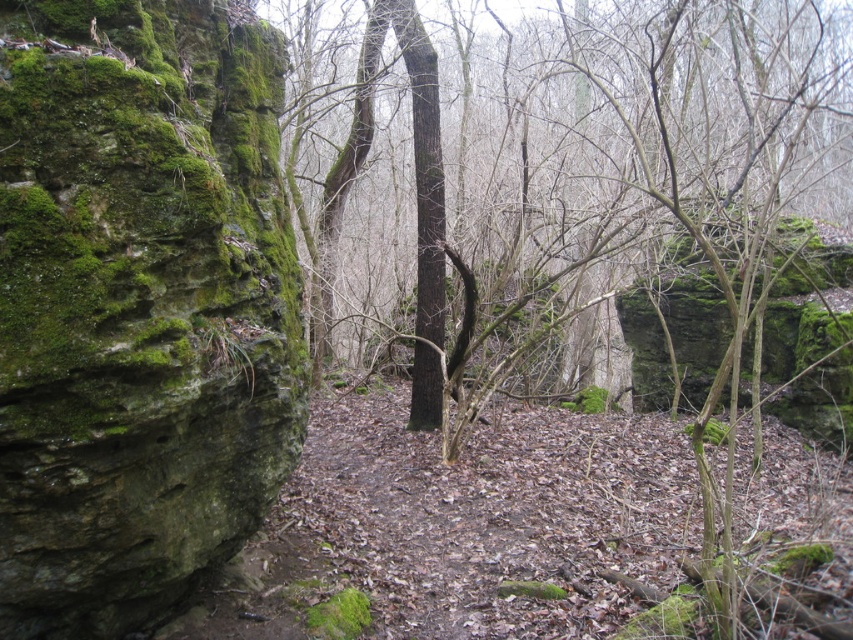
Can you confirm if green mossy tree at center is smaller than green mossy rock at left?

Actually, green mossy tree at center might be larger than green mossy rock at left.

This screenshot has width=853, height=640. In order to click on green mossy tree at center in this screenshot , I will do `click(527, 385)`.